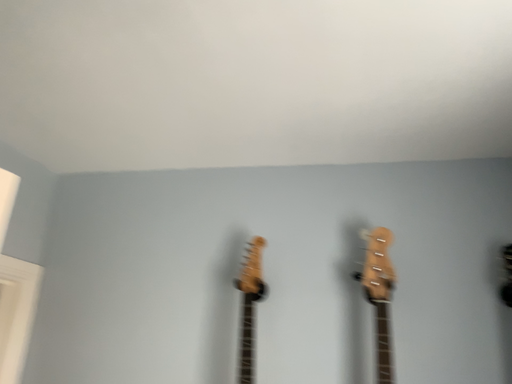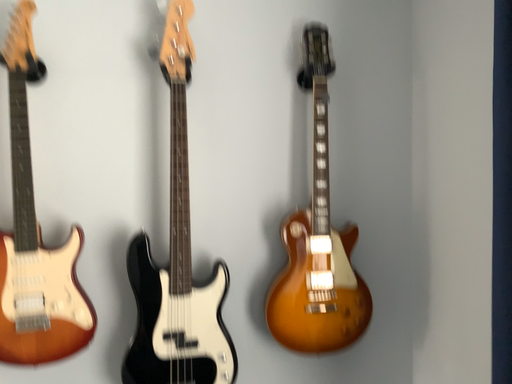
Question: Which way did the camera rotate in the video?

Choices:
 (A) rotated left
 (B) rotated right

Answer: (B)